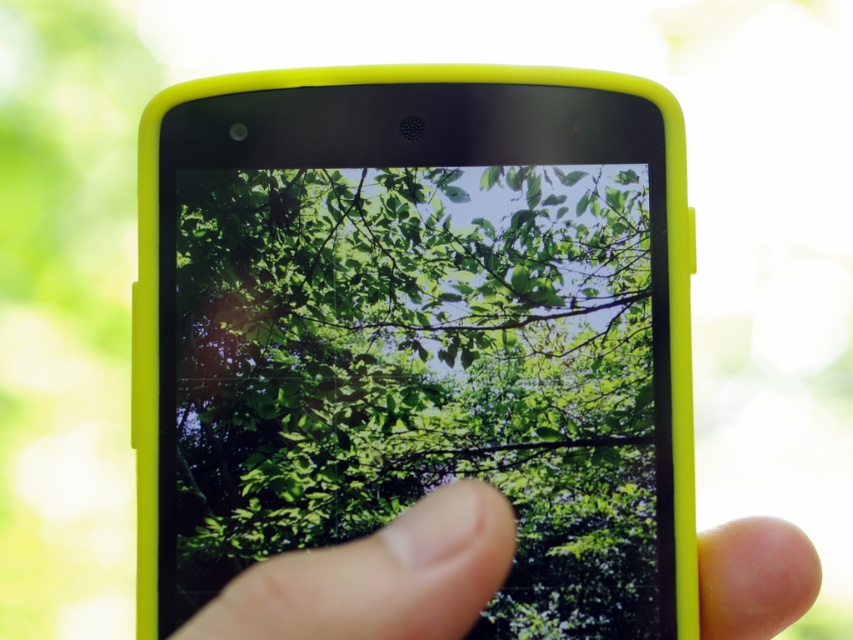
Question: Among these points, which one is nearest to the camera?

Choices:
 (A) (334, 260)
 (B) (469, 621)

Answer: (B)

Question: Is the position of green leafy tree at center less distant than that of finger at center?

Choices:
 (A) yes
 (B) no

Answer: (B)

Question: Can you confirm if green leafy tree at center is bigger than finger at center?

Choices:
 (A) yes
 (B) no

Answer: (B)

Question: Can you confirm if green leafy tree at center is positioned to the right of finger at center?

Choices:
 (A) no
 (B) yes

Answer: (A)

Question: Among these points, which one is nearest to the camera?

Choices:
 (A) [x=454, y=568]
 (B) [x=245, y=196]

Answer: (A)